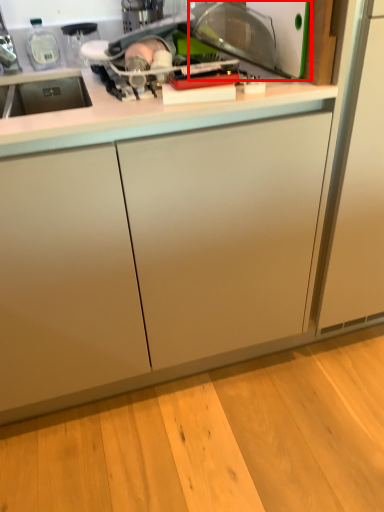
Question: Where is appliance (annotated by the red box) located in relation to countertop in the image?

Choices:
 (A) right
 (B) left

Answer: (A)